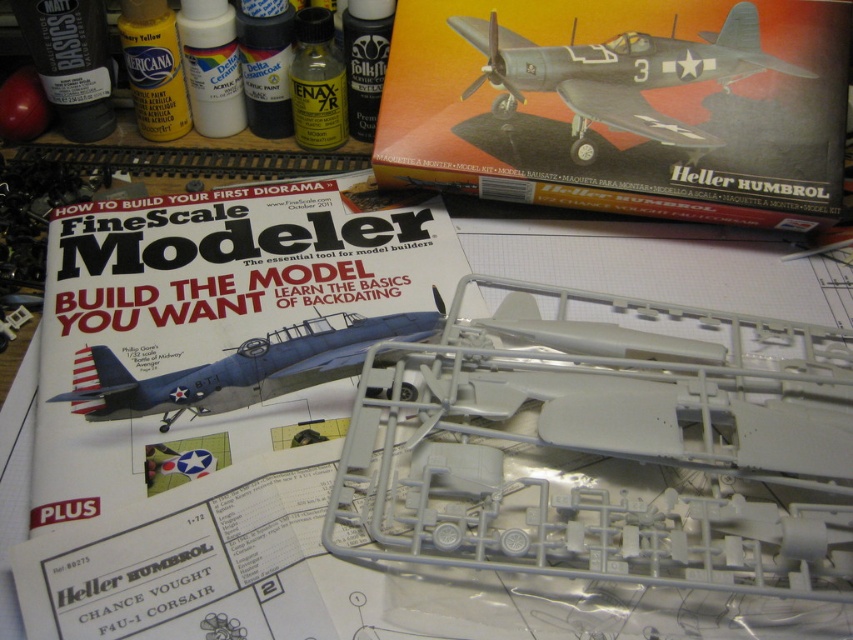
You are a model builder looking at the workspace. You notice two points marked at coordinates point [708,131] and point [318,324]. Which point is closer to you?

Point [708,131] is further to the camera than point [318,324], so the point closer to you is point [318,324].

Consider the image. You are an aviation enthusiast examining two model airplanes displayed in a showcase. The showcase contains a white plastic airplane at center and a blue matte airplane at center. Which airplane is taller?

The white plastic airplane at center is taller than the blue matte airplane at center.

Looking at this image, you are holding a paintbrush and want to reach the point at coordinates point [651,321]. If your arm can extend 20 inches, will you be able to reach it?

The point at coordinates point [651,321] is 21.68 inches away from you, which is beyond the 20 inches your arm can extend. Therefore, you cannot reach it with your current arm extension.